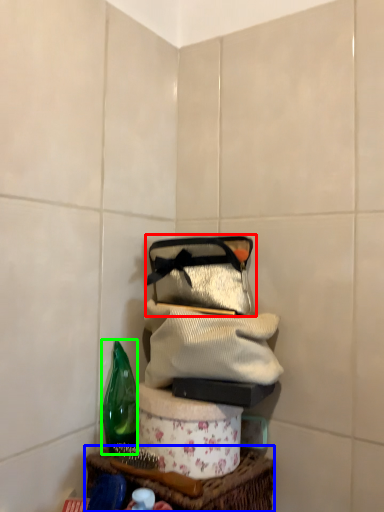
Question: Which object is positioned closest to handbag (highlighted by a red box)? Select from table (highlighted by a blue box) and bottle (highlighted by a green box).

Choices:
 (A) table
 (B) bottle

Answer: (B)